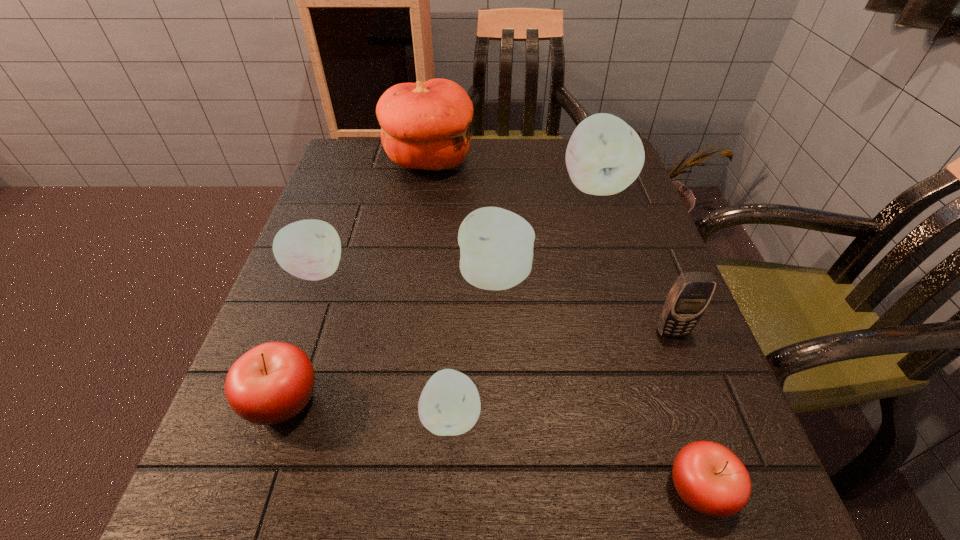
This screenshot has height=540, width=960. In order to click on vacant region at the far left corner of the desktop in this screenshot , I will do `click(355, 144)`.

Identify the location of vacant area that lies between the pumpkin and the farther red apple. This screenshot has height=540, width=960. (356, 281).

In order to click on free space between the rightmost white apple and the nearest white apple in this screenshot , I will do `click(524, 301)`.

I want to click on unoccupied position between the cellular telephone and the farther red apple, so click(x=477, y=366).

At what (x,y) coordinates should I click in order to perform the action: click on vacant area between the farthest white apple and the pumpkin. Please return your answer as a coordinate pair (x, y). The image size is (960, 540). Looking at the image, I should click on (513, 173).

Image resolution: width=960 pixels, height=540 pixels. What are the coordinates of `free spot between the farther red apple and the tallest apple` in the screenshot? It's located at (440, 293).

Image resolution: width=960 pixels, height=540 pixels. Find the location of `vacant area that lies between the rightmost white apple and the nearest white apple`. vacant area that lies between the rightmost white apple and the nearest white apple is located at coordinates (524, 301).

Where is `blank region between the farther red apple and the third biggest white apple`? blank region between the farther red apple and the third biggest white apple is located at coordinates (300, 335).

You are a GUI agent. You are given a task and a screenshot of the screen. Output one action in this format:
    pyautogui.click(x=<x>, y=<y>)
    Task: Click on the vacant area that lies between the right red apple and the second tallest apple
    The height and width of the screenshot is (540, 960).
    Given the screenshot: What is the action you would take?
    pyautogui.click(x=597, y=383)

The width and height of the screenshot is (960, 540). I want to click on vacant area that lies between the farthest apple and the pumpkin, so click(513, 173).